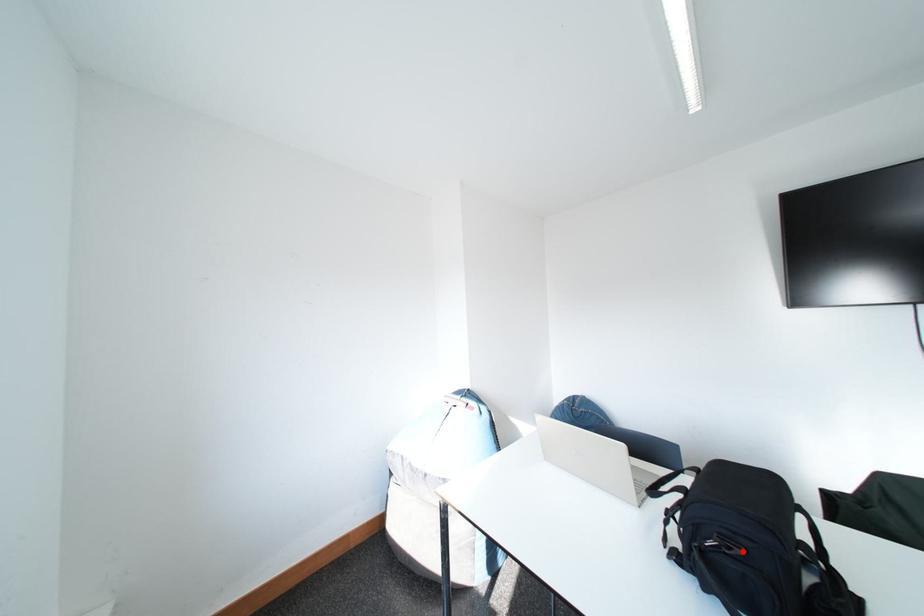
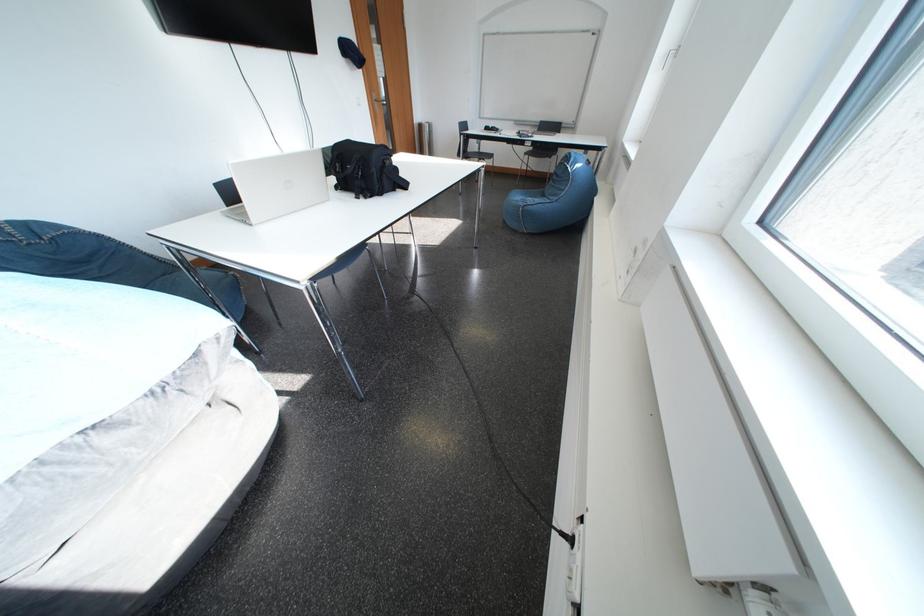
Question: I am providing you with two images of the same scene from different viewpoints. A red point is marked on the first image. Is the red point's position out of view in image 2?

Choices:
 (A) Yes
 (B) No

Answer: (A)